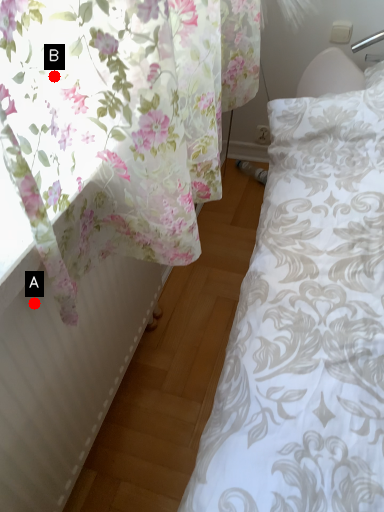
Question: Two points are circled on the image, labeled by A and B beside each circle. Which point is closer to the camera?

Choices:
 (A) A is closer
 (B) B is closer

Answer: (B)